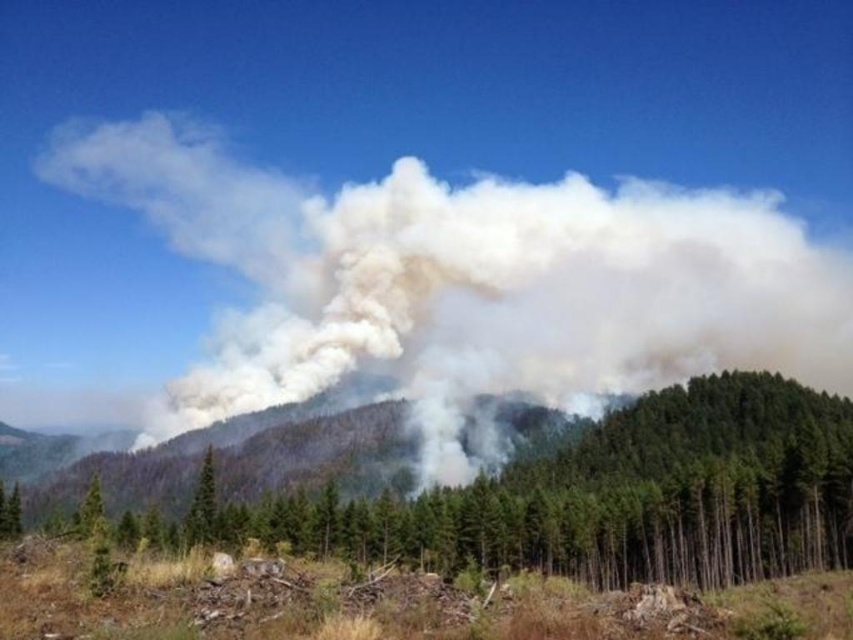
Is point (589, 352) in front of point (367, 486)?

No.

Which is more to the left, white smoke at center or smoke-filled forest at center?

smoke-filled forest at center is more to the left.

Who is more forward, (647, 362) or (149, 449)?

Positioned in front is point (149, 449).

At what (x,y) coordinates should I click in order to perform the action: click on white smoke at center. Please return your answer as a coordinate pair (x, y). The height and width of the screenshot is (640, 853). Looking at the image, I should click on (471, 284).

Based on the photo, does white smoke at center have a lesser height compared to green textured pine tree at center?

In fact, white smoke at center may be taller than green textured pine tree at center.

This screenshot has height=640, width=853. What do you see at coordinates (471, 284) in the screenshot? I see `white smoke at center` at bounding box center [471, 284].

Identify the location of white smoke at center. (471, 284).

Where is `white smoke at center`? This screenshot has height=640, width=853. white smoke at center is located at coordinates (471, 284).

Based on the photo, which is more to the right, smoke-filled forest at center or green textured pine tree at center?

Positioned to the right is green textured pine tree at center.

Who is more forward, (248, 465) or (204, 502)?

Point (204, 502) is in front.

Locate an element on the screen. The width and height of the screenshot is (853, 640). smoke-filled forest at center is located at coordinates (235, 456).